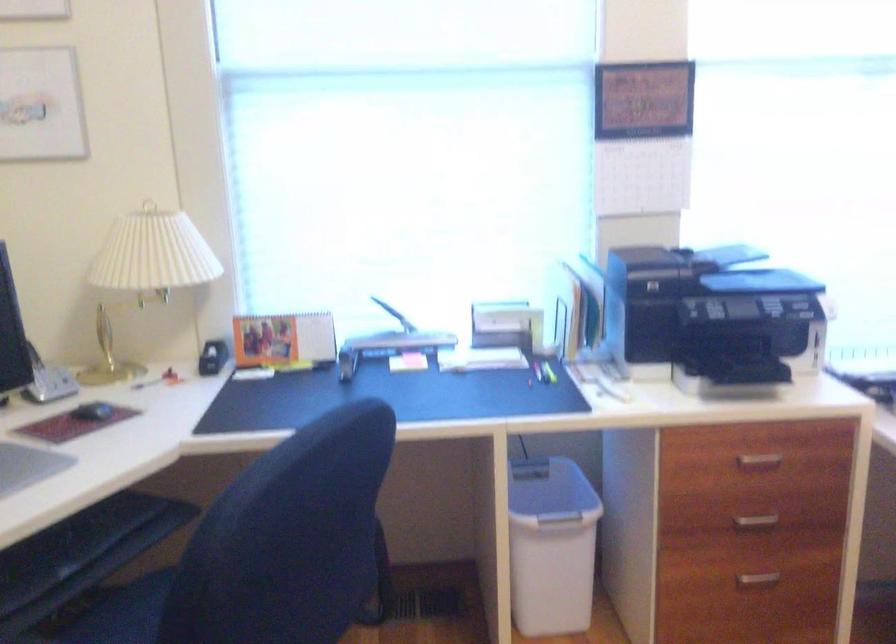
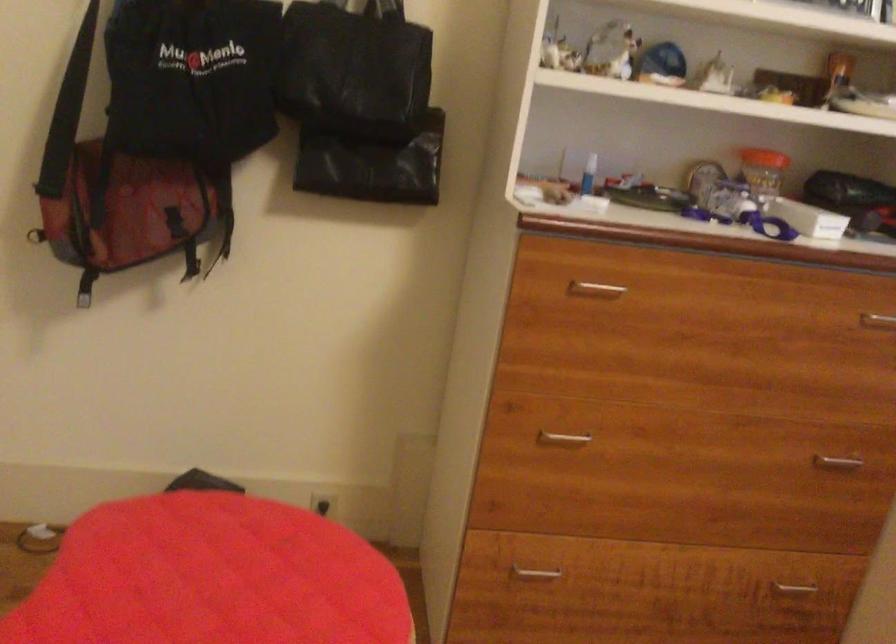
The first image is from the beginning of the video and the second image is from the end. How did the camera likely rotate when shooting the video?

The rotation direction of the camera is left-down.